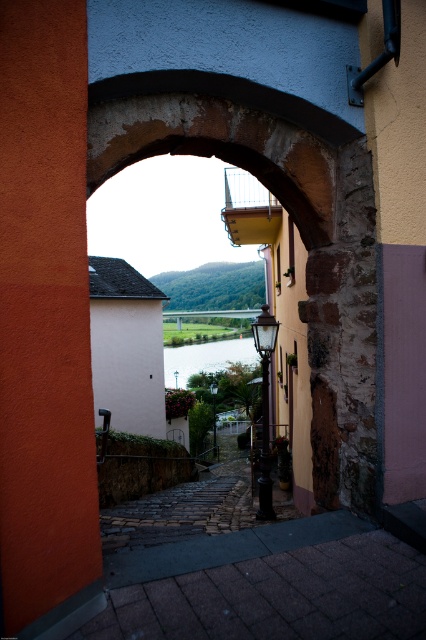
Question: Which is nearer to the matte black lamp post at center?

Choices:
 (A) polished brass lamp post at center
 (B) orange stucco wall at left
 (C) clear water at center

Answer: (C)

Question: Among these objects, which one is nearest to the camera?

Choices:
 (A) orange stucco wall at left
 (B) clear water at center

Answer: (A)

Question: Which object is closer to the camera taking this photo?

Choices:
 (A) matte black lamp post at center
 (B) polished brass lamp post at center
 (C) clear water at center

Answer: (B)

Question: Does clear water at center have a smaller size compared to matte black lamp post at center?

Choices:
 (A) no
 (B) yes

Answer: (A)

Question: Is orange stucco wall at left behind polished brass lamp post at center?

Choices:
 (A) no
 (B) yes

Answer: (A)

Question: Does orange stucco wall at left appear on the left side of polished brass lamp post at center?

Choices:
 (A) no
 (B) yes

Answer: (B)